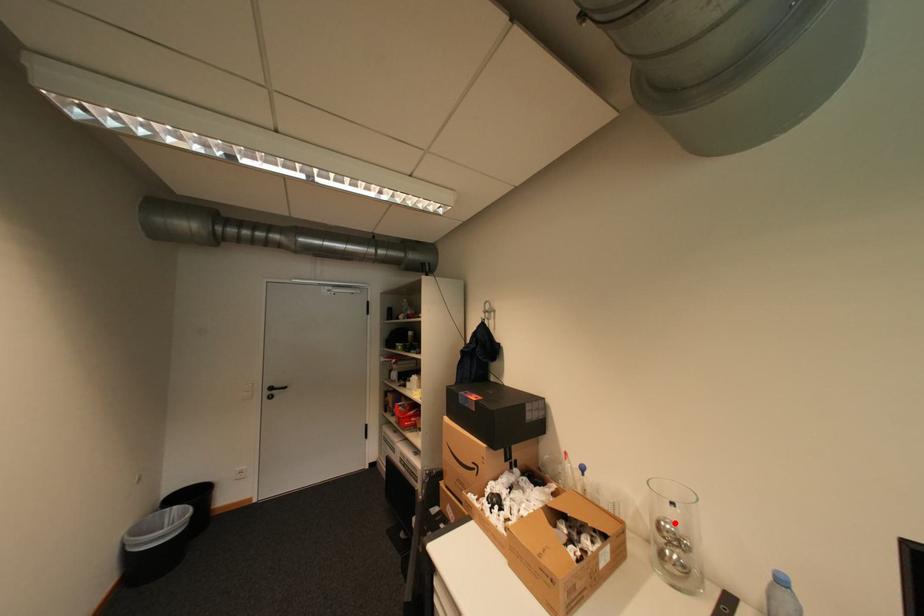
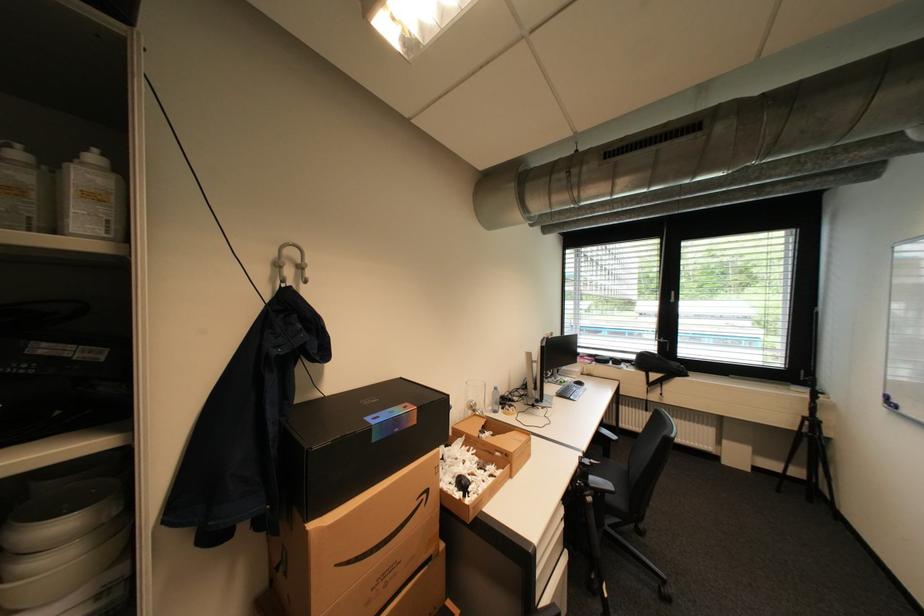
Question: I am providing you with two images of the same scene from different viewpoints. In image1, a red point is highlighted. Considering the same 3D point in image2, which of the following is correct?

Choices:
 (A) It is closer
 (B) It is farther

Answer: (B)